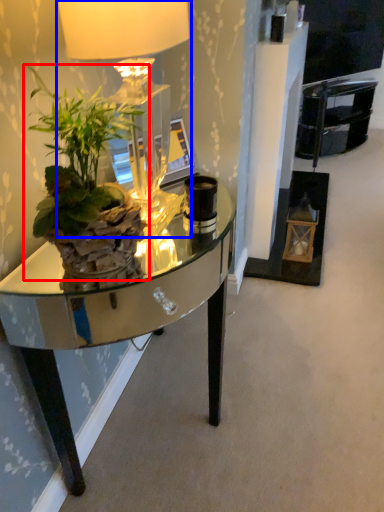
Question: Which object is further to the camera taking this photo, houseplant (highlighted by a red box) or lamp (highlighted by a blue box)?

Choices:
 (A) houseplant
 (B) lamp

Answer: (B)